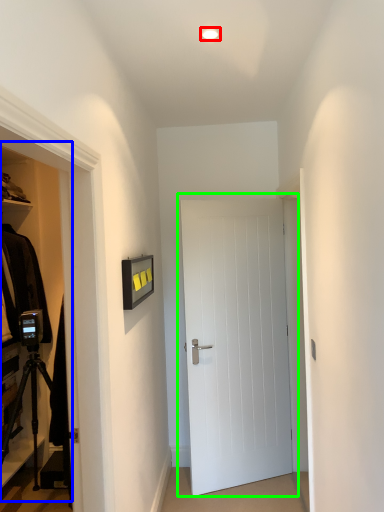
Question: Based on their relative distances, which object is farther from lighting (highlighted by a red box)? Choose from dresser (highlighted by a blue box) and door (highlighted by a green box).

Choices:
 (A) dresser
 (B) door

Answer: (A)